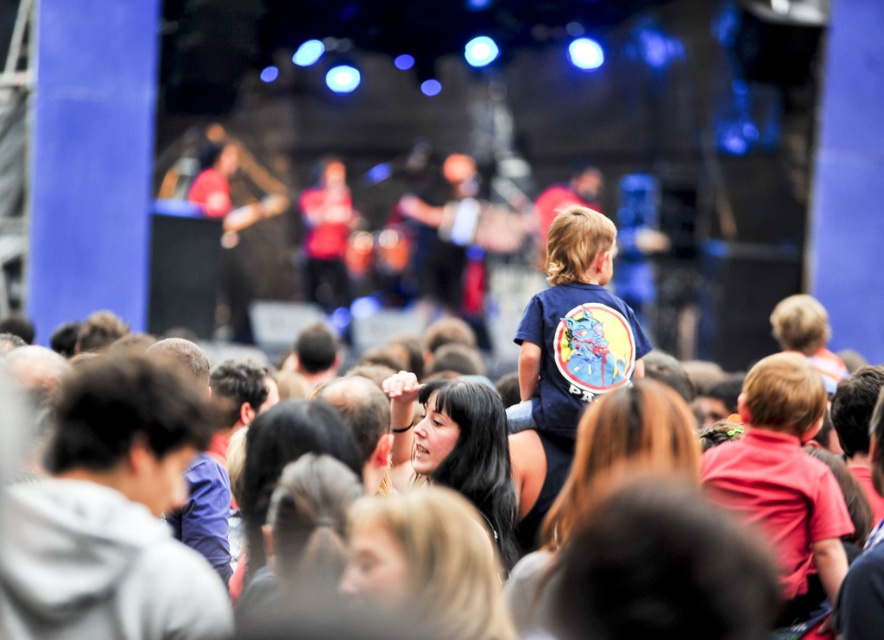
Question: Which point is closer to the camera?

Choices:
 (A) (574, 362)
 (B) (370, 465)
 (C) (706, 456)

Answer: (B)

Question: Which is farther from the navy blue t-shirt at center?

Choices:
 (A) gray hoodie at left
 (B) red matte shirt at center

Answer: (A)

Question: Does gray hoodie at left appear on the left side of red matte shirt at center?

Choices:
 (A) no
 (B) yes

Answer: (B)

Question: Considering the relative positions of navy blue t-shirt at center and dark brown hair at center in the image provided, where is navy blue t-shirt at center located with respect to dark brown hair at center?

Choices:
 (A) right
 (B) left

Answer: (A)

Question: Which of these objects is positioned farthest from the navy blue t-shirt at center?

Choices:
 (A) red matte shirt at center
 (B) gray hoodie at left

Answer: (B)

Question: Considering the relative positions of gray hoodie at left and navy blue t-shirt at center in the image provided, where is gray hoodie at left located with respect to navy blue t-shirt at center?

Choices:
 (A) above
 (B) below

Answer: (B)